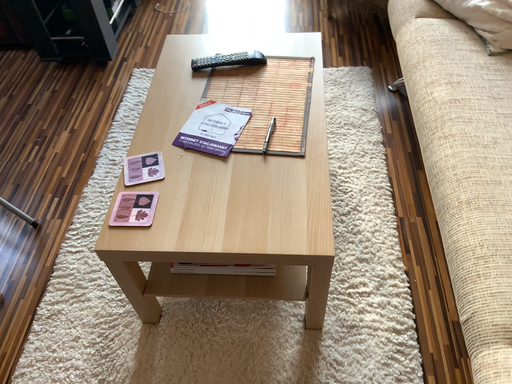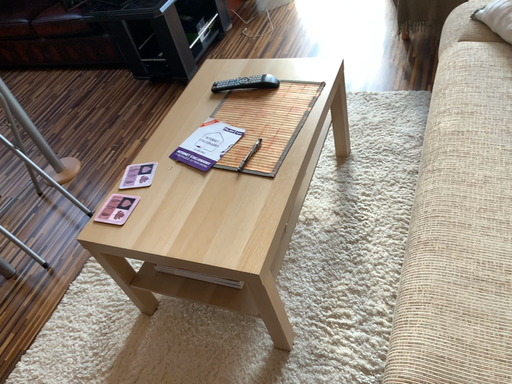
Question: How did the camera likely rotate when shooting the video?

Choices:
 (A) rotated right
 (B) rotated left

Answer: (B)